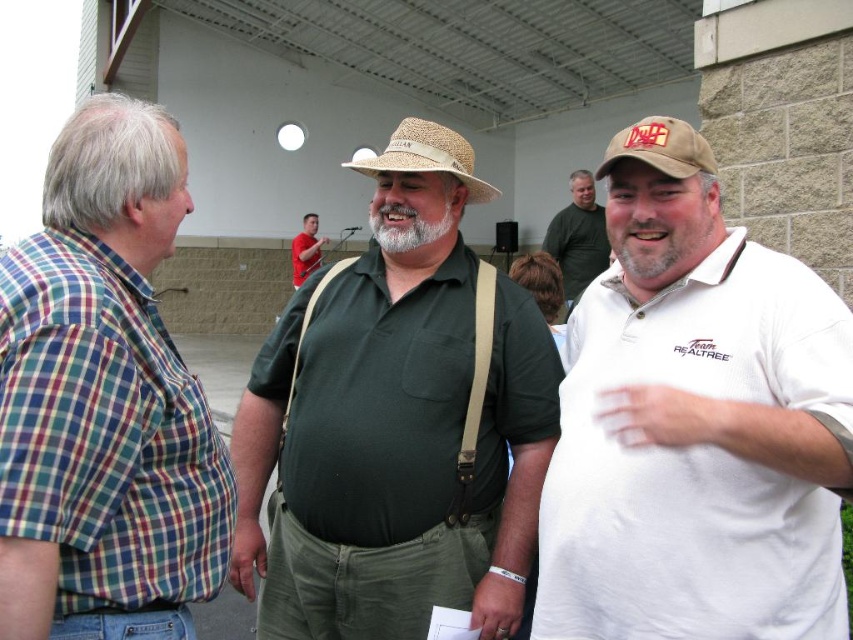
You are standing at the point marked as point (103, 400) in the image. Which object are you touching?

The point (103, 400) is on the plaid shirt at left, so you are touching the plaid shirt at left.

You are organizing a photo shoot and need to place two props on a table. The plaid shirt at left and the tan straw cowboy hat at center must be arranged such that their widths match the original image. Which object should you place on the left side of the table to ensure proper width proportion?

The plaid shirt at left has a smaller width compared to the tan straw cowboy hat at center. To maintain the correct proportions, place the plaid shirt at left on the left side of the table since it is narrower.

You are standing at the origin point in the image. There is a gray beard face at center represented by point (x=660, y=240). Can you tell me the direction of the gray beard face at center relative to your position?

The gray beard face at center is located at point (x=660, y=240), which is to the upper right of the origin point.